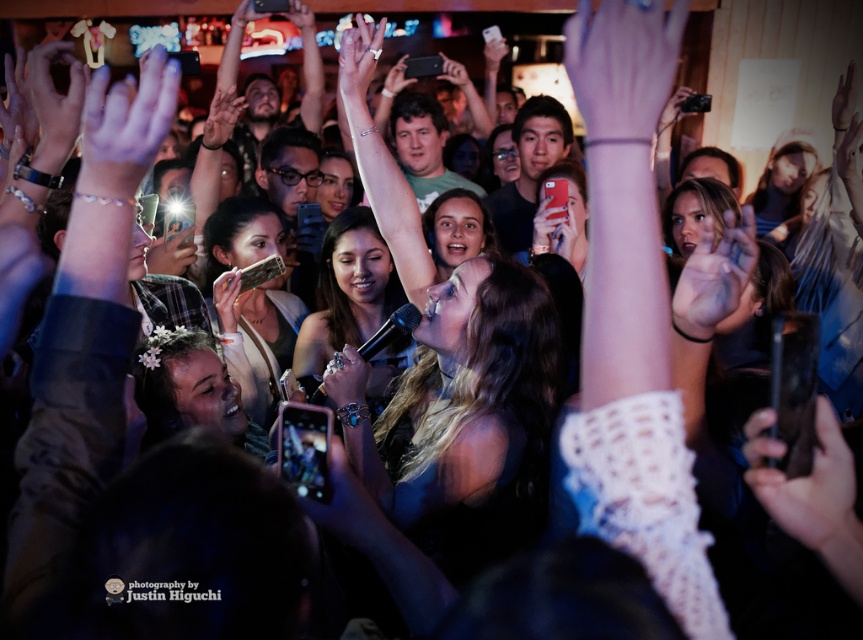
Is point (366, 380) farther from camera compared to point (219, 291)?

No, it is in front of (219, 291).

Does matte silver ring at center have a lesser width compared to matte black phone at center?

No.

Find the location of `matte silver ring at center`. matte silver ring at center is located at coordinates (345, 376).

You are a GUI agent. You are given a task and a screenshot of the screen. Output one action in this format:
    pyautogui.click(x=<x>, y=<y>)
    Task: Click on the matte silver ring at center
    The width and height of the screenshot is (863, 640).
    Given the screenshot: What is the action you would take?
    pyautogui.click(x=345, y=376)

Does white knitted glove at center appear on the right side of matte silver ring at center?

Yes, white knitted glove at center is to the right of matte silver ring at center.

Which is below, white knitted glove at center or matte silver ring at center?

white knitted glove at center is below.

Which is in front, point (835, 524) or point (322, 381)?

Point (835, 524) is in front.

This screenshot has width=863, height=640. Identify the location of white knitted glove at center. (808, 486).

In the scene shown: Does transparent skin at center appear under matte silver ring at center?

No.

The image size is (863, 640). Describe the element at coordinates (717, 276) in the screenshot. I see `transparent skin at center` at that location.

Between point (693, 280) and point (341, 365), which one is positioned in front?

Point (693, 280)

At what (x,y) coordinates should I click in order to perform the action: click on transparent skin at center. Please return your answer as a coordinate pair (x, y). The height and width of the screenshot is (640, 863). Looking at the image, I should click on (717, 276).